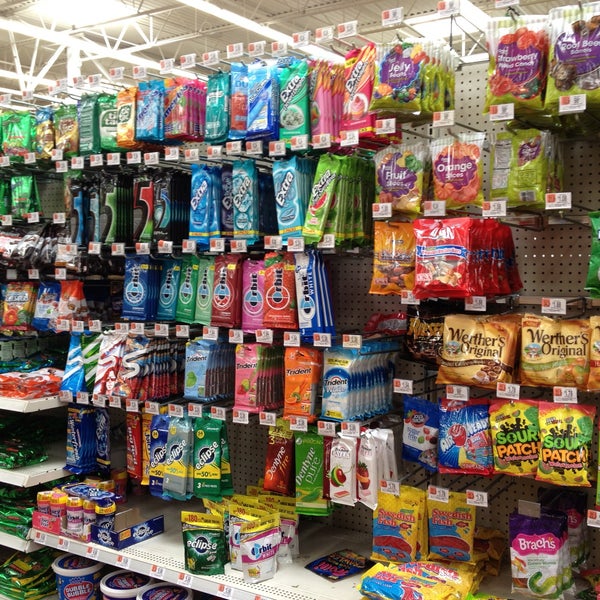
Image resolution: width=600 pixels, height=600 pixels. I want to click on metal shelf, so click(x=41, y=475), click(x=36, y=402), click(x=151, y=543), click(x=15, y=537).